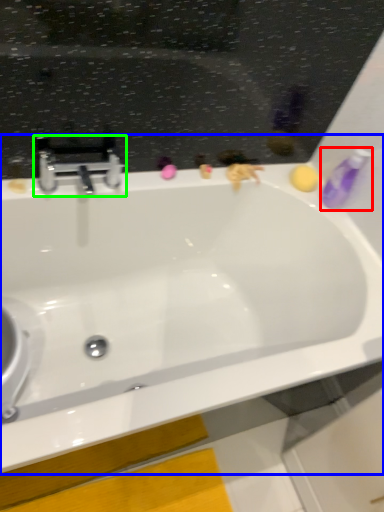
Question: Based on their relative distances, which object is nearer to toiletry (highlighted by a red box)? Choose from bathtub (highlighted by a blue box) and tap (highlighted by a green box).

Choices:
 (A) bathtub
 (B) tap

Answer: (A)